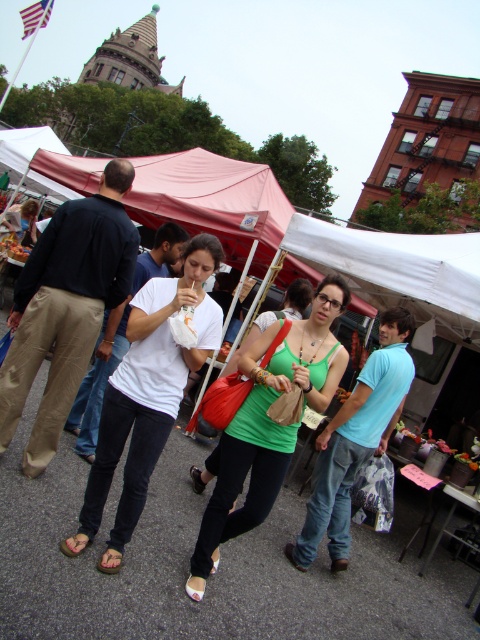
Question: Is white matte t-shirt at center above green fabric sandal at lower left?

Choices:
 (A) yes
 (B) no

Answer: (A)

Question: Is green matte tank top at center wider than light blue cotton shirt at center?

Choices:
 (A) no
 (B) yes

Answer: (B)

Question: Which point is closer to the camera?

Choices:
 (A) green fabric sandal at lower left
 (B) light blue cotton shirt at center
 (C) white matte t-shirt at center
 (D) pink fabric canopy at center

Answer: (A)

Question: Which object is positioned closest to the brown leather sandal at lower left?

Choices:
 (A) green matte tank top at center
 (B) green fabric sandal at lower left
 (C) white fabric canopy at center

Answer: (B)

Question: Which point is closer to the camera?

Choices:
 (A) brown leather sandal at lower left
 (B) green fabric sandal at lower left
 (C) white fabric canopy at center
 (D) light blue cotton shirt at center

Answer: (B)

Question: Does white matte t-shirt at center appear over brown leather sandal at lower left?

Choices:
 (A) no
 (B) yes

Answer: (B)